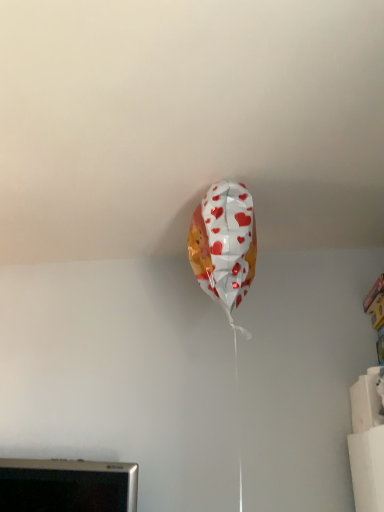
The image size is (384, 512). What do you see at coordinates (224, 245) in the screenshot?
I see `white paper balloon with red hearts at upper center` at bounding box center [224, 245].

The image size is (384, 512). What are the coordinates of `white paper balloon with red hearts at upper center` in the screenshot? It's located at (224, 245).

Locate an element on the screen. This screenshot has height=512, width=384. white paper balloon with red hearts at upper center is located at coordinates (224, 245).